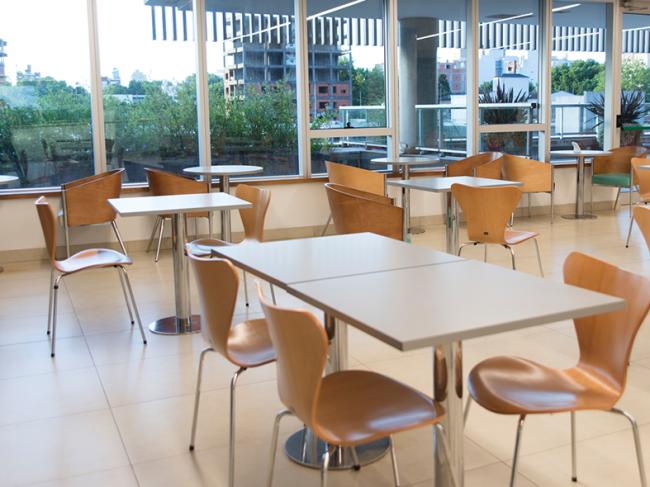
This screenshot has width=650, height=487. What are the coordinates of `chair` in the screenshot? It's located at (66, 279), (223, 330), (315, 400), (562, 409).